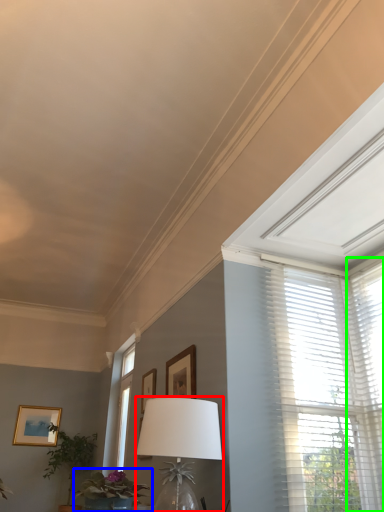
Question: Which object is the farthest from table lamp (highlighted by a red box)? Choose among these: houseplant (highlighted by a blue box) or window blind (highlighted by a green box).

Choices:
 (A) houseplant
 (B) window blind

Answer: (B)